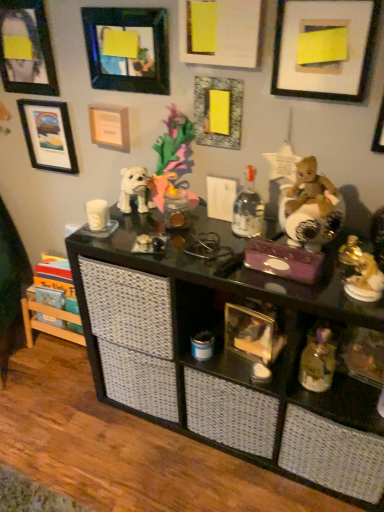
The height and width of the screenshot is (512, 384). I want to click on free space behind gold metallic figurine at right, which appears as the 3th toy when viewed from the top, so click(346, 254).